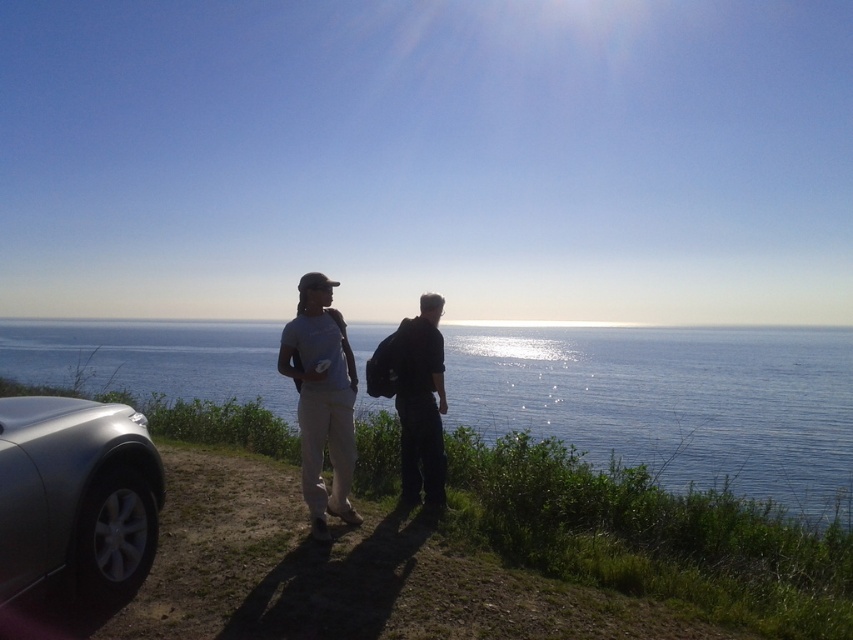
Question: Which object is closer to the camera taking this photo?

Choices:
 (A) black matte backpack at center
 (B) silver metallic car at lower left

Answer: (B)

Question: Can you confirm if silver metallic car at lower left is positioned below light gray cotton pants at center?

Choices:
 (A) yes
 (B) no

Answer: (A)

Question: Based on their relative distances, which object is nearer to the light gray cotton pants at center?

Choices:
 (A) black matte backpack at center
 (B) blue water at center
 (C) silver metallic car at lower left
 (D) gray cotton t-shirt at center

Answer: (D)

Question: Which of the following is the closest to the observer?

Choices:
 (A) (135, 444)
 (B) (323, 400)
 (C) (61, 364)
 (D) (300, 337)

Answer: (A)

Question: Does blue water at center have a larger size compared to silver metallic car at lower left?

Choices:
 (A) no
 (B) yes

Answer: (B)

Question: Considering the relative positions of blue water at center and black matte backpack at center in the image provided, where is blue water at center located with respect to black matte backpack at center?

Choices:
 (A) below
 (B) above

Answer: (B)